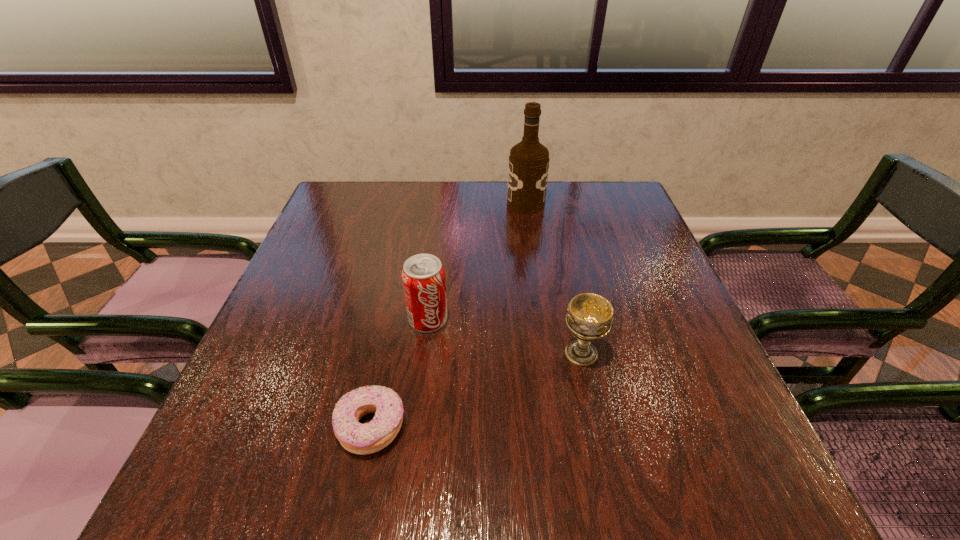
Identify the location of vacant space at the far left corner. point(348,207).

Where is `free area in between the farthest object and the nearest object`? This screenshot has height=540, width=960. free area in between the farthest object and the nearest object is located at coordinates (448, 315).

At what (x,y) coordinates should I click in order to perform the action: click on vacant area that lies between the soda can and the tallest object. Please return your answer as a coordinate pair (x, y). Looking at the image, I should click on (477, 262).

The image size is (960, 540). In order to click on unoccupied area between the second shortest object and the doughnut in this screenshot , I will do `click(476, 390)`.

Where is `free spot between the soda can and the chalice`? This screenshot has width=960, height=540. free spot between the soda can and the chalice is located at coordinates (505, 336).

The image size is (960, 540). Identify the location of free area in between the second farthest object and the doughnut. (400, 374).

At what (x,y) coordinates should I click in order to perform the action: click on free area in between the second farthest object and the alcohol. Please return your answer as a coordinate pair (x, y). This screenshot has height=540, width=960. Looking at the image, I should click on (477, 262).

Where is `free space between the third shortest object and the chalice`? This screenshot has width=960, height=540. free space between the third shortest object and the chalice is located at coordinates (505, 336).

Image resolution: width=960 pixels, height=540 pixels. Find the location of `blank region between the second tallest object and the chalice`. blank region between the second tallest object and the chalice is located at coordinates (505, 336).

Where is `free space between the third nearest object and the alcohol`? free space between the third nearest object and the alcohol is located at coordinates (477, 262).